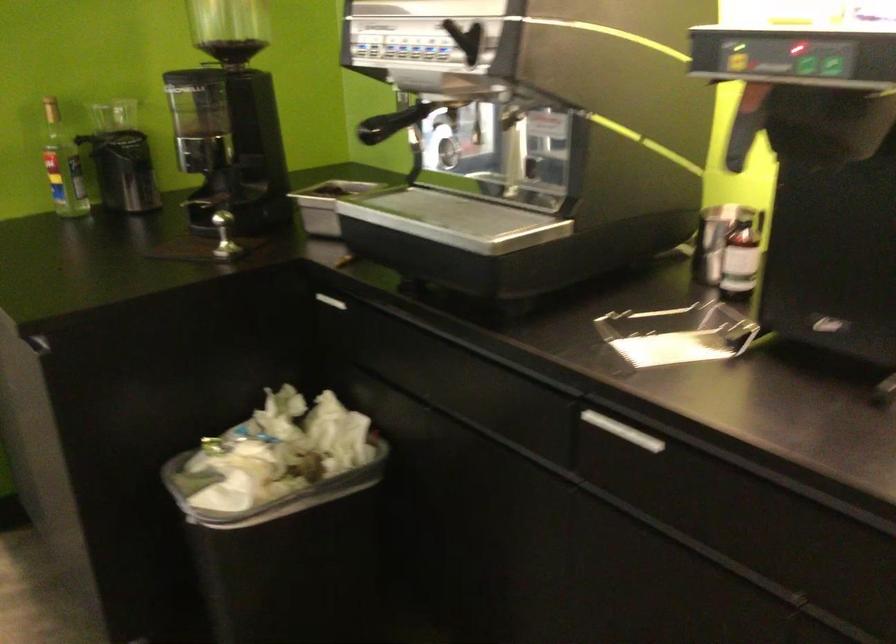
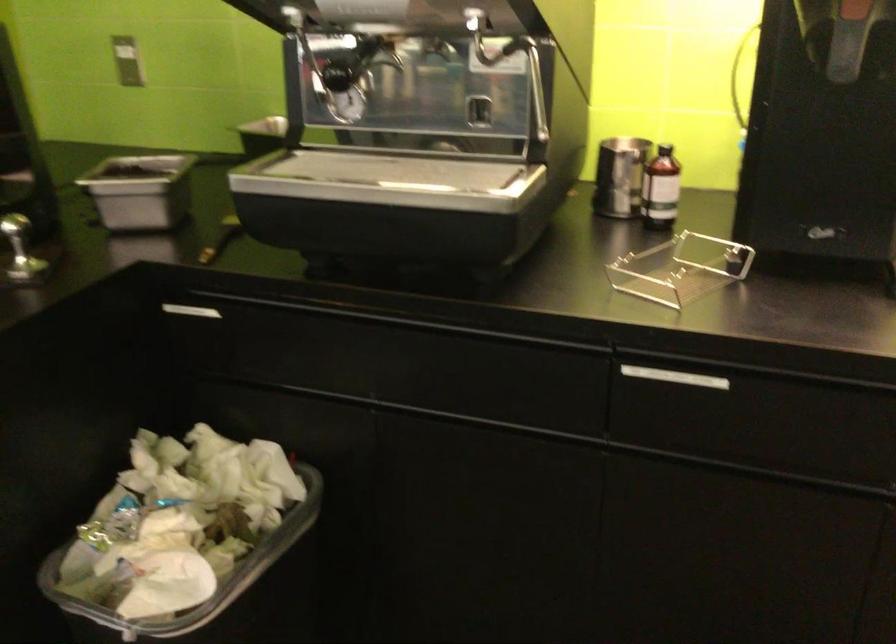
Find the pixel in the second image that matches (328,299) in the first image.

(192, 310)